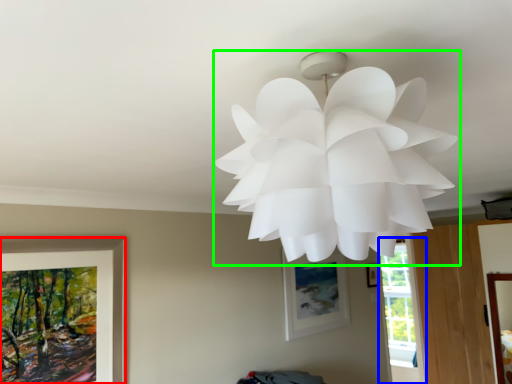
Question: Which object is the farthest from picture frame (highlighted by a red box)? Choose among these: window (highlighted by a blue box) or lamp (highlighted by a green box).

Choices:
 (A) window
 (B) lamp

Answer: (A)